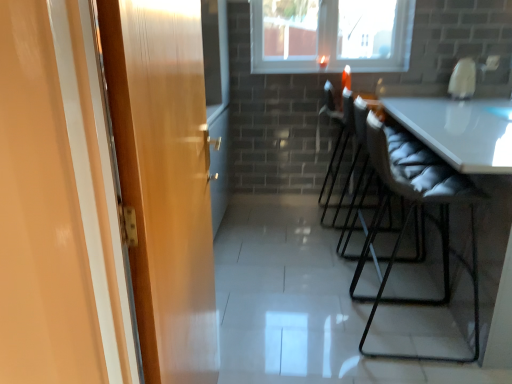
Image resolution: width=512 pixels, height=384 pixels. Identify the location of vacant space situated on the left part of black leather chair at center, acting as the 1th chair starting from the back. (298, 218).